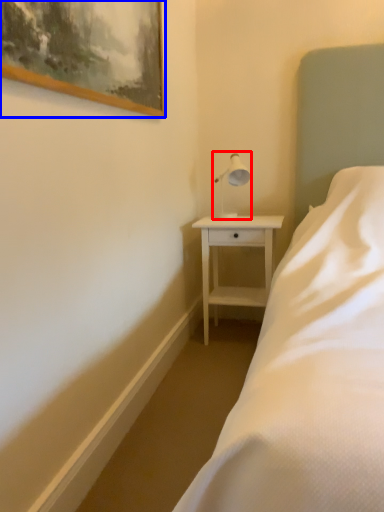
Question: Which object appears closest to the camera in this image, table lamp (highlighted by a red box) or picture frame (highlighted by a blue box)?

Choices:
 (A) table lamp
 (B) picture frame

Answer: (B)